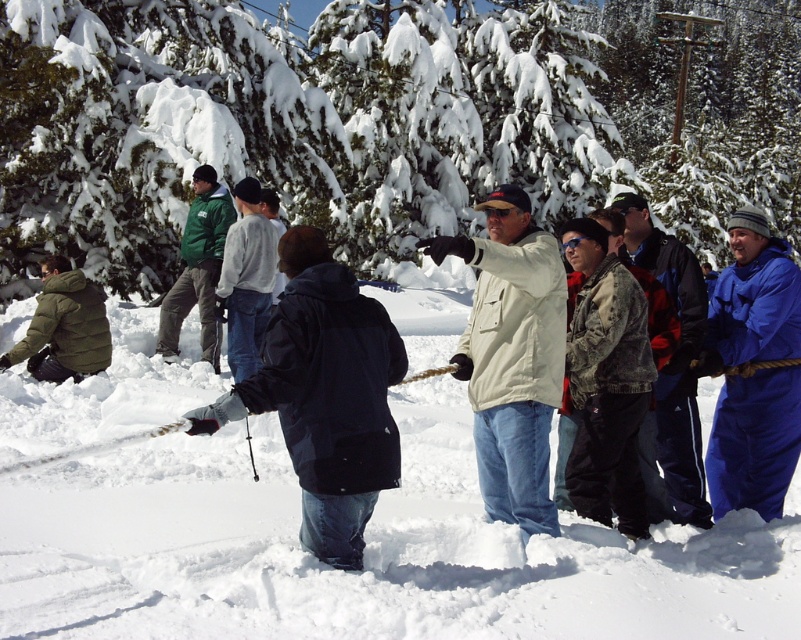
Looking at this image, you are organizing a winter event and need to ensure participants have appropriate clothing. You notice two participants wearing the blue fleece jacket at right and the green fleece jacket at center. Which jacket is more suitable for the cold weather based on their thickness?

The green fleece jacket at center is thicker than the blue fleece jacket at right, making it more suitable for cold weather.

You are standing in the snowy area and want to hand a hot chocolate to the person in the green fleece jacket at center. Which direction should you move to reach them first without passing through the blue fleece jacket at right?

The blue fleece jacket at right is positioned under the green fleece jacket at center, so you should move forward towards the green fleece jacket at center as the blue one is behind it.

You are standing at the edge of the snowy field and see two people participating in the tug of war. One is wearing a beige fabric jacket at center and the other a green fleece jacket at center. Which jacket is closer to you?

The beige fabric jacket at center is closer to the viewer than the green fleece jacket at center.